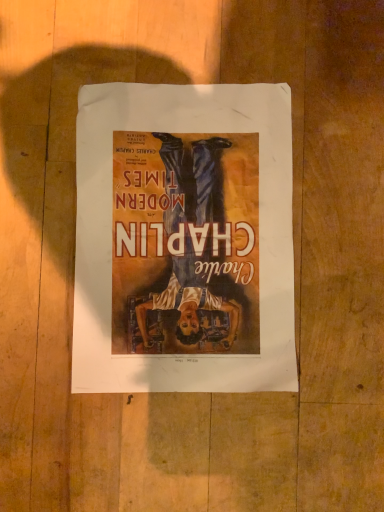
This screenshot has width=384, height=512. Identify the location of free point above matte paper poster at center (from a real-world perspective). (191, 250).